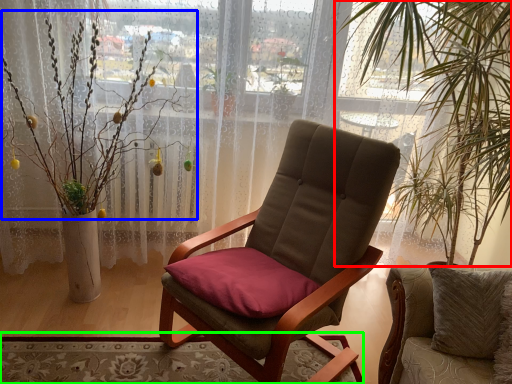
Question: Which object is the farthest from vegetation (highlighted by a red box)? Choose among these: floral arrangement (highlighted by a blue box) or mat (highlighted by a green box).

Choices:
 (A) floral arrangement
 (B) mat

Answer: (A)